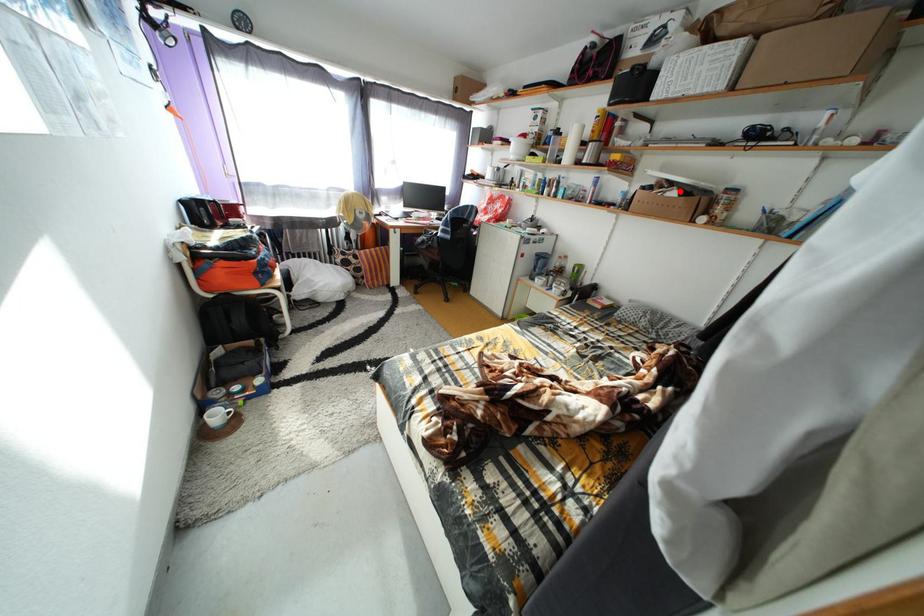
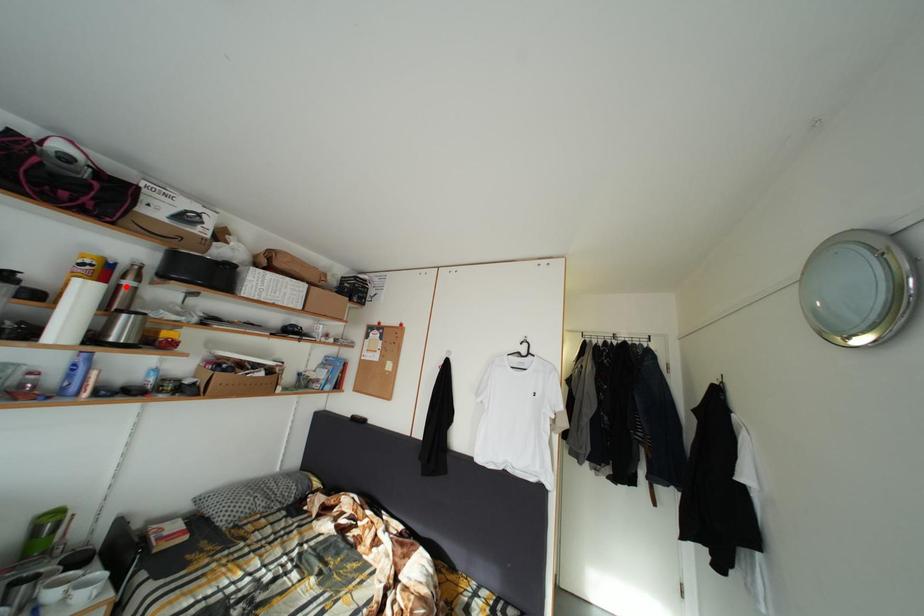
I am providing you with two images of the same scene from different viewpoints. A red point is marked on the first image and another point is marked on the second image. Is the marked point in image1 the same physical position as the marked point in image2?

No